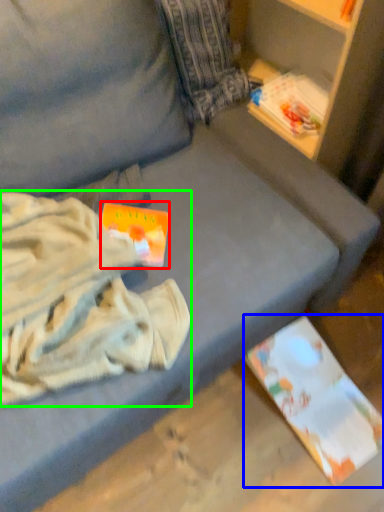
Question: Considering the real-world distances, which object is closest to paperback book (highlighted by a red box)? paperback book (highlighted by a blue box) or clothing (highlighted by a green box).

Choices:
 (A) paperback book
 (B) clothing

Answer: (B)